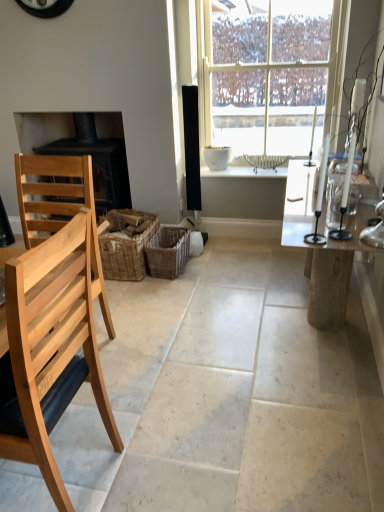
You are a GUI agent. You are given a task and a screenshot of the screen. Output one action in this format:
    pyautogui.click(x=<x>, y=<y>)
    Task: Click on the vacant space that is to the left of clear glass table at right
    This screenshot has width=384, height=512.
    Given the screenshot: What is the action you would take?
    pyautogui.click(x=205, y=314)